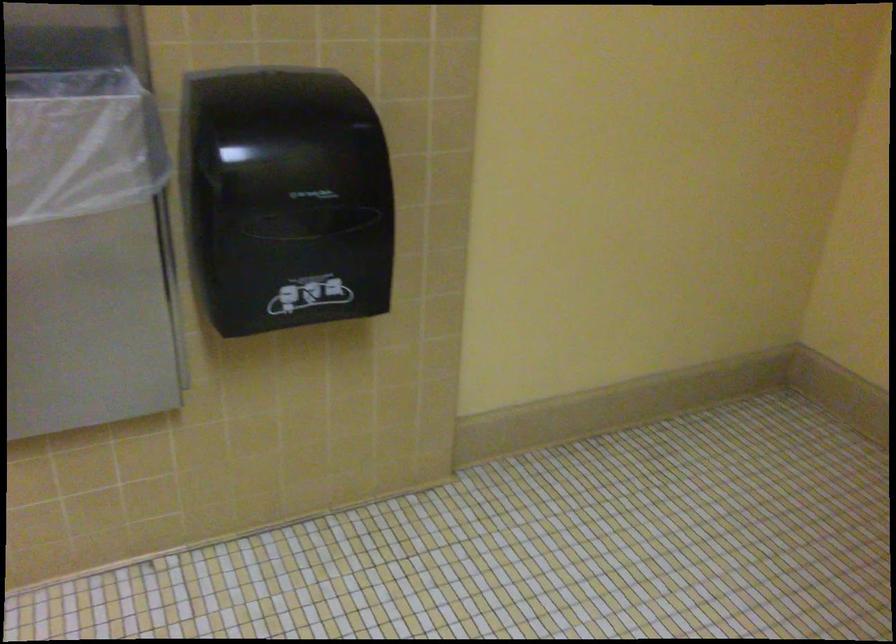
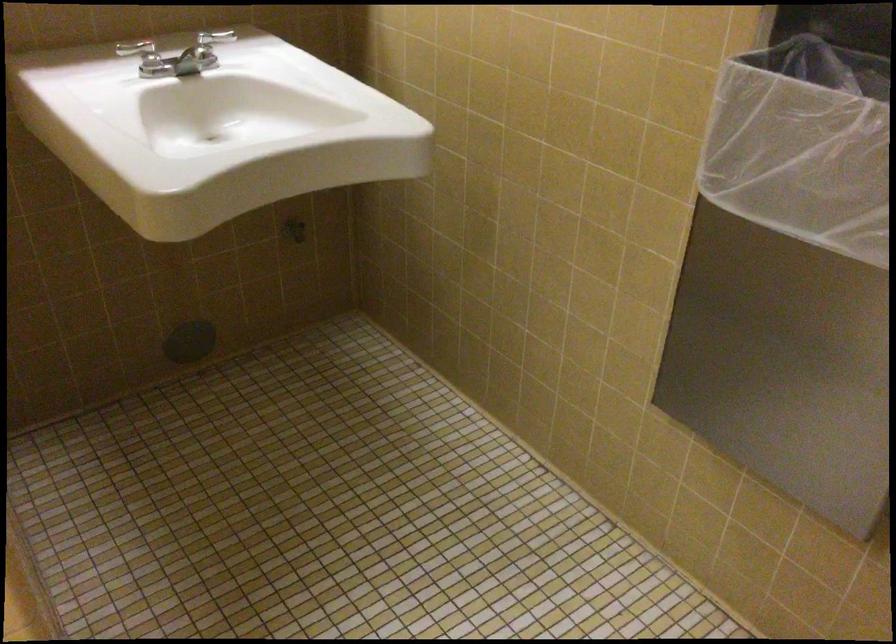
The first image is from the beginning of the video and the second image is from the end. How did the camera likely rotate when shooting the video?

The camera rotated toward left-down.